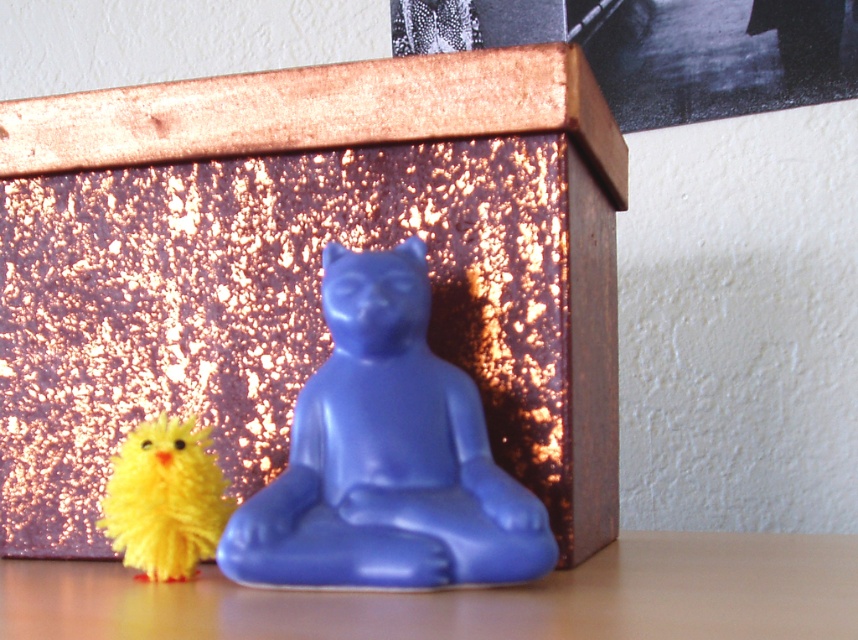
Does metallic gold box at center come in front of yellow fuzzy chick at lower left?

That is False.

Can you confirm if metallic gold box at center is positioned to the left of yellow fuzzy chick at lower left?

In fact, metallic gold box at center is to the right of yellow fuzzy chick at lower left.

Describe the element at coordinates (304, 268) in the screenshot. I see `metallic gold box at center` at that location.

Where is `metallic gold box at center`? metallic gold box at center is located at coordinates (304, 268).

Between matte blue statue at center and yellow fuzzy chick at lower left, which one is positioned lower?

yellow fuzzy chick at lower left is below.

Is point (263, 509) positioned in front of point (156, 497)?

Yes, it is.

The image size is (858, 640). In order to click on matte blue statue at center in this screenshot , I will do `click(385, 456)`.

Can you confirm if metallic gold box at center is shorter than matte blue statue at center?

No.

Which is below, metallic gold box at center or matte blue statue at center?

Positioned lower is matte blue statue at center.

Between point (597, 282) and point (306, 516), which one is positioned in front?

Point (306, 516)

The height and width of the screenshot is (640, 858). Identify the location of metallic gold box at center. (304, 268).